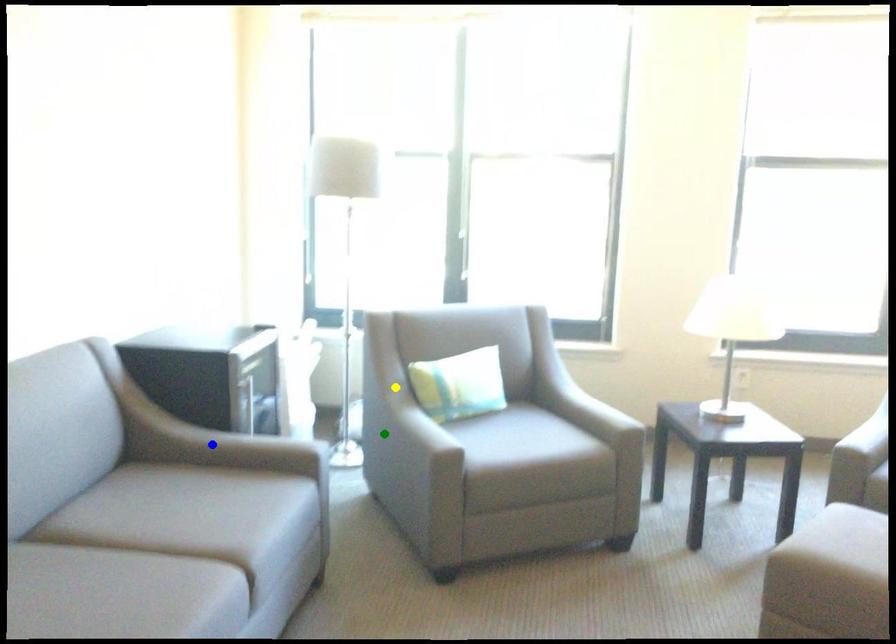
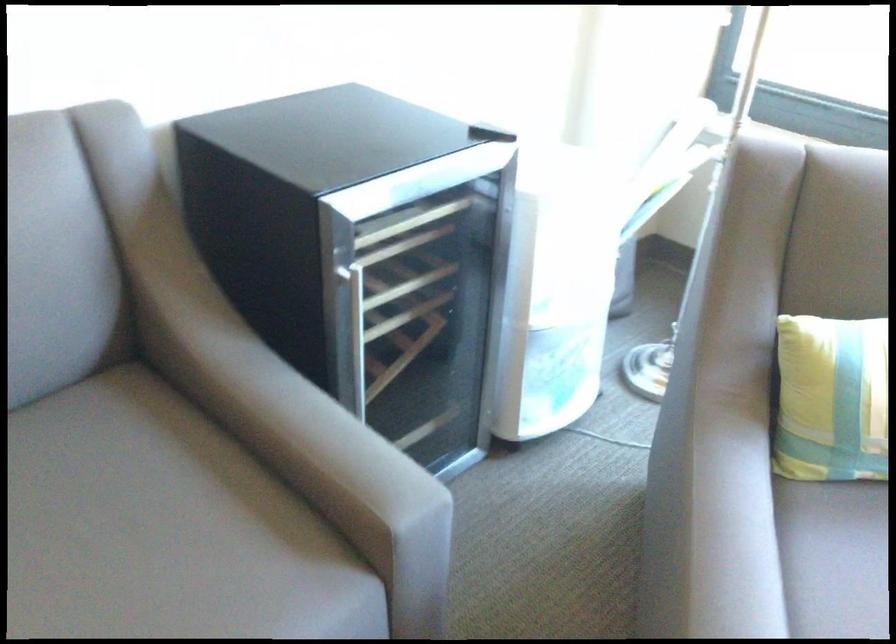
I am providing you with two images of the same scene from different viewpoints. Three points are marked in image1. Which point corresponds to a part or object that is occluded in image2?In image1, three points are marked. Which of them correspond to a part or object that is occluded in image2?Among the three points shown in image1, which one corresponds to a part or object that is no longer visible due to occlusion in image2?

blue point cannot be seen in image2.